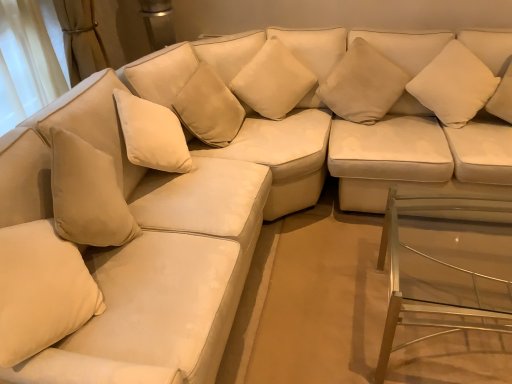
Question: Does beige fabric pillow at lower left, arranged as the 4th pillow when viewed from the right, have a greater height compared to clear glass table at lower right?

Choices:
 (A) yes
 (B) no

Answer: (A)

Question: Is beige fabric pillow at lower left, marked as the first pillow in a left-to-right arrangement, further to the viewer compared to clear glass table at lower right?

Choices:
 (A) yes
 (B) no

Answer: (B)

Question: From a real-world perspective, is beige fabric pillow at lower left, arranged as the 4th pillow when viewed from the right, over clear glass table at lower right?

Choices:
 (A) yes
 (B) no

Answer: (A)

Question: From the image's perspective, is beige fabric pillow at lower left, marked as the first pillow in a left-to-right arrangement, below clear glass table at lower right?

Choices:
 (A) no
 (B) yes

Answer: (A)

Question: Is beige fabric pillow at lower left, marked as the first pillow in a left-to-right arrangement, turned away from clear glass table at lower right?

Choices:
 (A) no
 (B) yes

Answer: (A)

Question: Is point (479, 198) positioned closer to the camera than point (287, 100)?

Choices:
 (A) farther
 (B) closer

Answer: (B)

Question: Is clear glass table at lower right in front of or behind suede-like beige pillow at center, positioned as the 3th pillow in right-to-left order, in the image?

Choices:
 (A) front
 (B) behind

Answer: (A)

Question: From the image's perspective, relative to suede-like beige pillow at center, positioned as the 3th pillow in right-to-left order, is clear glass table at lower right above or below?

Choices:
 (A) above
 (B) below

Answer: (B)

Question: Is clear glass table at lower right spatially inside suede-like beige pillow at center, positioned as the 3th pillow in right-to-left order, or outside of it?

Choices:
 (A) outside
 (B) inside

Answer: (A)

Question: From the image's perspective, is suede-like beige pillow at center, positioned as the 3th pillow in right-to-left order, located above or below white soft cushion at upper right, the fourth pillow from the left?

Choices:
 (A) above
 (B) below

Answer: (A)

Question: From a real-world perspective, relative to white soft cushion at upper right, placed as the first pillow when sorted from right to left, is suede-like beige pillow at center, which ranks as the second pillow in left-to-right order, vertically above or below?

Choices:
 (A) above
 (B) below

Answer: (A)

Question: Which is correct: suede-like beige pillow at center, which ranks as the second pillow in left-to-right order, is inside white soft cushion at upper right, the fourth pillow from the left, or outside of it?

Choices:
 (A) outside
 (B) inside

Answer: (A)

Question: Considering the positions of suede-like beige pillow at center, which ranks as the second pillow in left-to-right order, and white soft cushion at upper right, placed as the first pillow when sorted from right to left, in the image, is suede-like beige pillow at center, which ranks as the second pillow in left-to-right order, taller or shorter than white soft cushion at upper right, placed as the first pillow when sorted from right to left,?

Choices:
 (A) short
 (B) tall

Answer: (B)

Question: Does point (390, 304) appear closer or farther from the camera than point (91, 130)?

Choices:
 (A) closer
 (B) farther

Answer: (A)

Question: Is clear glass table at lower right taller or shorter than suede beige couch at left?

Choices:
 (A) short
 (B) tall

Answer: (A)